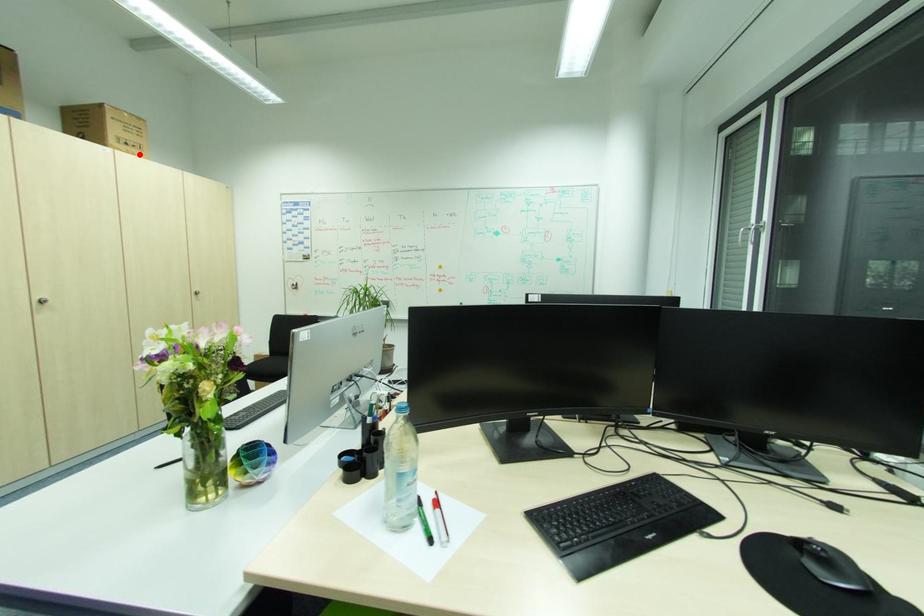
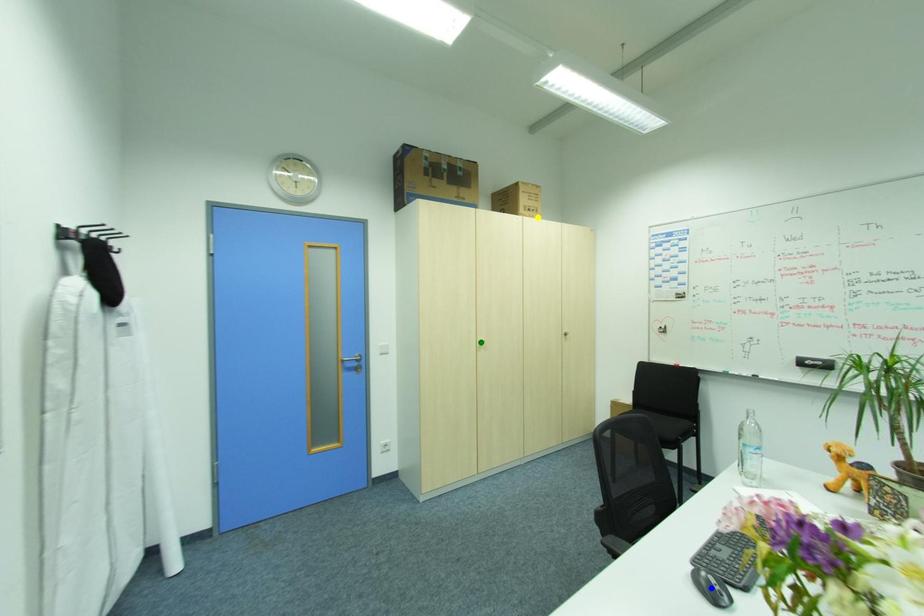
Question: I am providing you with two images of the same scene from different viewpoints. A red point is marked on the first image. You are given multiple points on the second image. In image 2, which mark is for the same physical point as the one in image 1?

Choices:
 (A) yellow point
 (B) blue point
 (C) green point

Answer: (A)